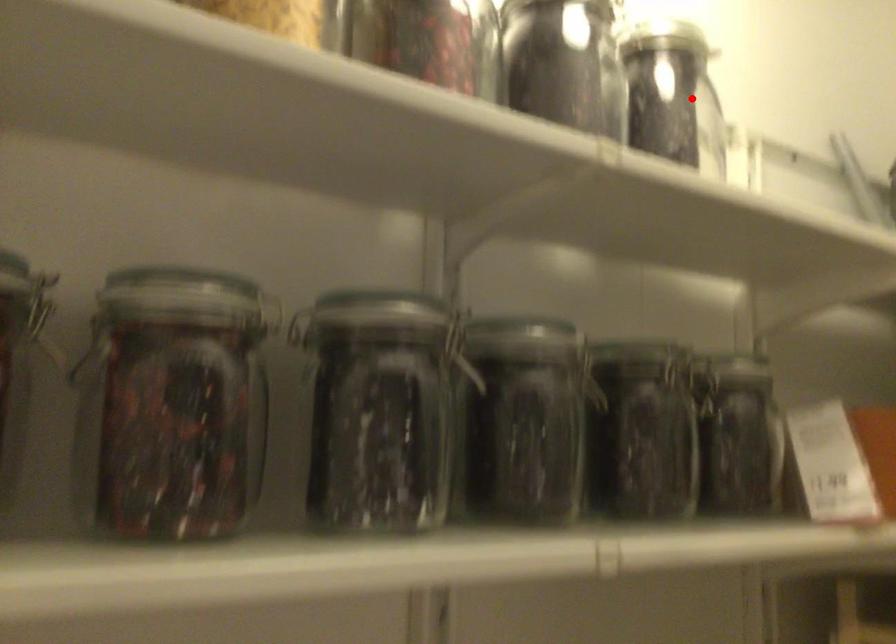
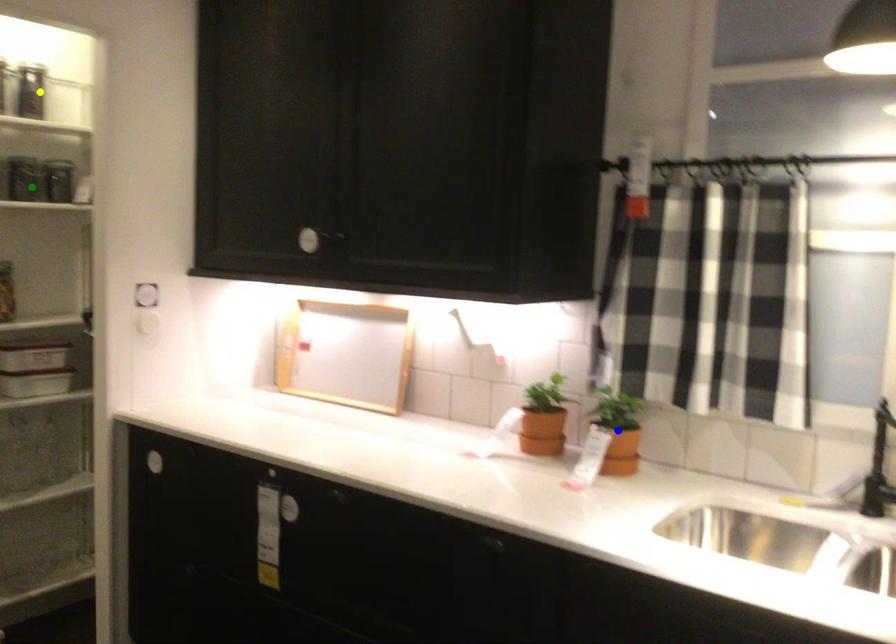
Question: I am providing you with two images of the same scene from different viewpoints. A red point is marked on the first image. You are given multiple points on the second image. Which point in image 2 represents the same 3d spot as the red point in image 1?

Choices:
 (A) green point
 (B) yellow point
 (C) blue point

Answer: (B)